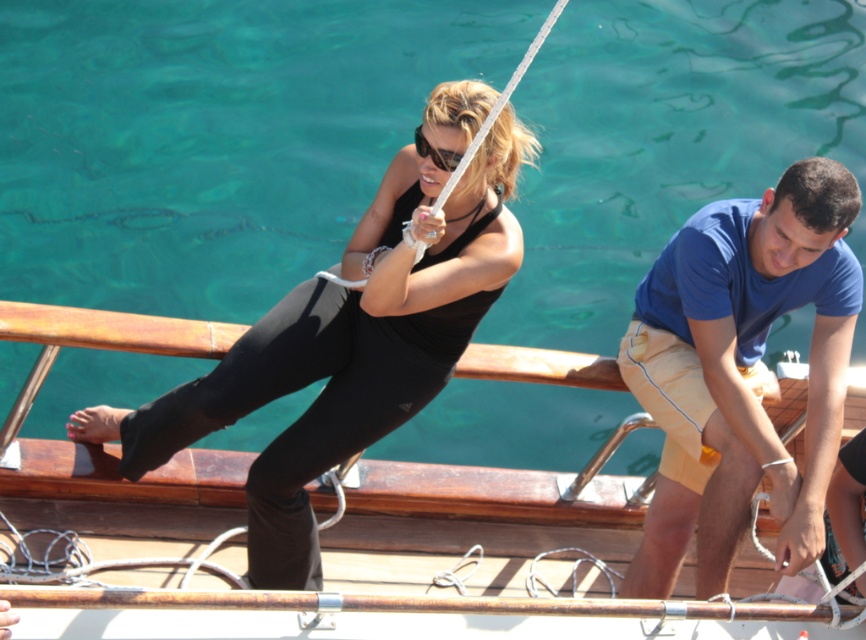
You are a photographer on the boat deck and want to capture a photo where both the clear blue water at center and the black matte tank top at center are visible. Which object should you focus on to ensure both are in the frame?

The clear blue water at center is bigger than the black matte tank top at center, so focusing on the larger clear blue water at center will ensure both objects are within the frame.

You are standing on the boat deck and need to place a thin wooden plank that is 10 cm wide. Which object between the wooden deck at center and the black matte tank top at center can the plank fit under? Please explain your reasoning.

The wooden deck at center is thinner than the black matte tank top at center. Since the wooden plank is 10 cm wide, it can fit under the wooden deck at center because it is narrower than the black matte tank top at center.

You are standing on the boat deck and need to locate the point at coordinates (740,371). Which object from the scene is this point located on?

The point at coordinates (740,371) is located on the blue cotton t shirt at right.